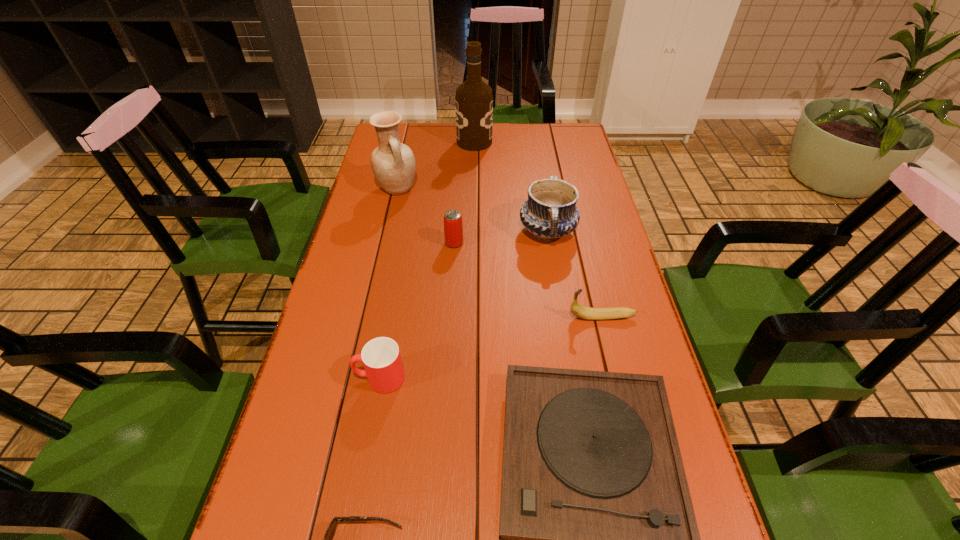
Image resolution: width=960 pixels, height=540 pixels. I want to click on free spot between the farther pottery and the cup, so click(389, 284).

You are a GUI agent. You are given a task and a screenshot of the screen. Output one action in this format:
    pyautogui.click(x=<x>, y=<y>)
    Task: Click on the free spot between the beer can and the sixth shortest object
    The width and height of the screenshot is (960, 540).
    Given the screenshot: What is the action you would take?
    pyautogui.click(x=501, y=237)

Identify which object is located as the seventh nearest to the banana. Please provide its 2D coordinates. Your answer should be formatted as a tuple, i.e. [(x, y)], where the tuple contains the x and y coordinates of a point satisfying the conditions above.

[(474, 101)]

The height and width of the screenshot is (540, 960). Identify the location of the sixth closest object to the tallest object. (598, 539).

I want to click on vacant position in the image that satisfies the following two spatial constraints: 1. on the side of the cup with the handle; 2. on the right side of the right pottery, so click(x=406, y=231).

Identify the location of free space that satisfies the following two spatial constraints: 1. on the side of the nearer pottery with the handle; 2. on the right side of the cup. Image resolution: width=960 pixels, height=540 pixels. (406, 231).

At what (x,y) coordinates should I click in order to perform the action: click on vacant space that satisfies the following two spatial constraints: 1. on the side of the cup with the handle; 2. on the front side of the farther pottery. Please return your answer as a coordinate pair (x, y). Looking at the image, I should click on (414, 190).